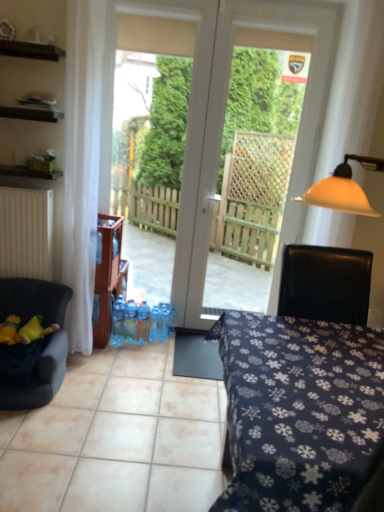
Locate an element on the screen. This screenshot has height=512, width=384. free space in front of blue plastic bottle at center, the fourth bottle from the left is located at coordinates (154, 349).